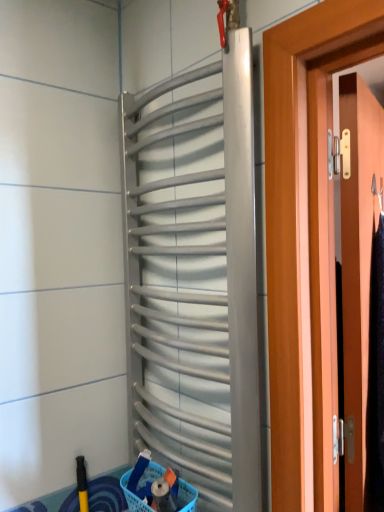
Question: From a real-world perspective, is yellow rubber brush at lower left positioned over blue plastic basket at lower center based on gravity?

Choices:
 (A) no
 (B) yes

Answer: (A)

Question: Is blue plastic basket at lower center completely or partially inside yellow rubber brush at lower left?

Choices:
 (A) no
 (B) yes

Answer: (A)

Question: Would you consider yellow rubber brush at lower left to be distant from blue plastic basket at lower center?

Choices:
 (A) no
 (B) yes

Answer: (A)

Question: From a real-world perspective, is yellow rubber brush at lower left positioned under blue plastic basket at lower center based on gravity?

Choices:
 (A) yes
 (B) no

Answer: (A)

Question: Could you tell me if yellow rubber brush at lower left is facing blue plastic basket at lower center?

Choices:
 (A) yes
 (B) no

Answer: (B)

Question: Would you say blue plastic basket at lower center is inside or outside wooden door at right?

Choices:
 (A) outside
 (B) inside

Answer: (A)

Question: In the image, is blue plastic basket at lower center on the left side or the right side of wooden door at right?

Choices:
 (A) right
 (B) left

Answer: (B)

Question: Considering the positions of blue plastic basket at lower center and wooden door at right in the image, is blue plastic basket at lower center wider or thinner than wooden door at right?

Choices:
 (A) wide
 (B) thin

Answer: (B)

Question: From the image's perspective, is blue plastic basket at lower center above or below wooden door at right?

Choices:
 (A) below
 (B) above

Answer: (A)

Question: Is wooden door at right wider or thinner than silver metallic radiator at center?

Choices:
 (A) thin
 (B) wide

Answer: (A)

Question: From their relative heights in the image, would you say wooden door at right is taller or shorter than silver metallic radiator at center?

Choices:
 (A) short
 (B) tall

Answer: (A)

Question: Is wooden door at right bigger or smaller than silver metallic radiator at center?

Choices:
 (A) small
 (B) big

Answer: (B)

Question: Is wooden door at right situated inside silver metallic radiator at center or outside?

Choices:
 (A) outside
 (B) inside

Answer: (A)

Question: From the image's perspective, is silver metallic radiator at center located above or below blue plastic basket at lower center?

Choices:
 (A) below
 (B) above

Answer: (B)

Question: Is silver metallic radiator at center wider or thinner than blue plastic basket at lower center?

Choices:
 (A) thin
 (B) wide

Answer: (B)